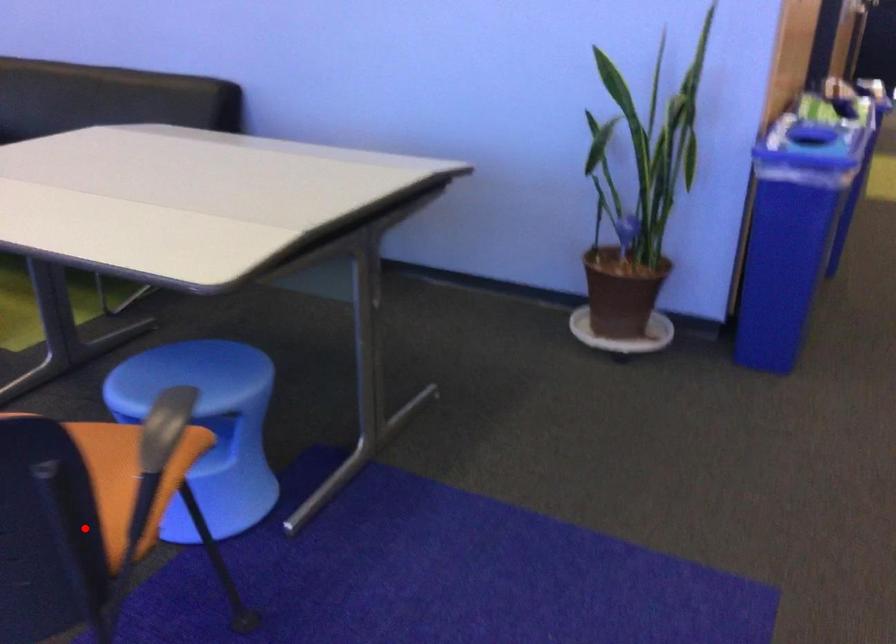
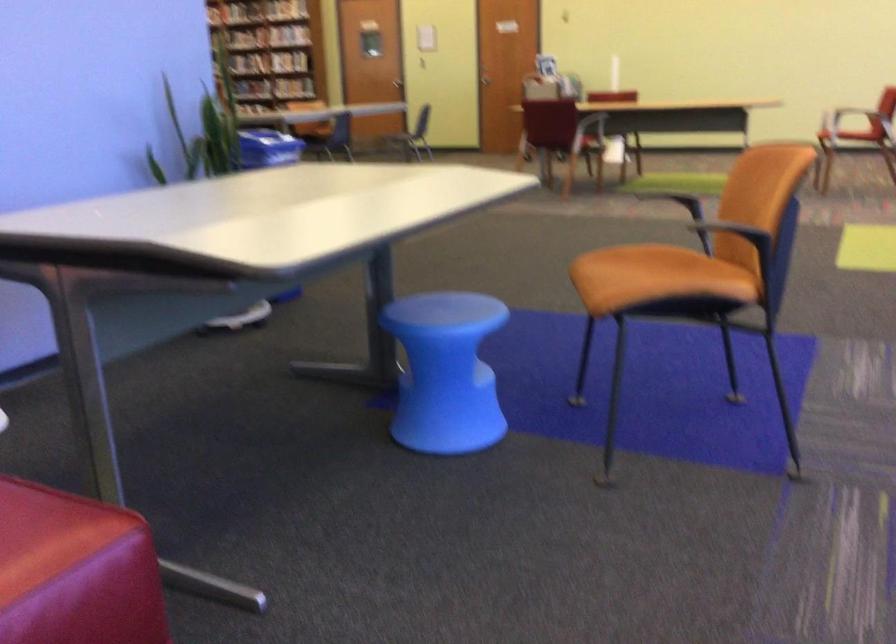
Question: I am providing you with two images of the same scene from different viewpoints. In image1, a red point is highlighted. Considering the same 3D point in image2, which of the following is correct?

Choices:
 (A) It is closer
 (B) It is farther

Answer: (B)